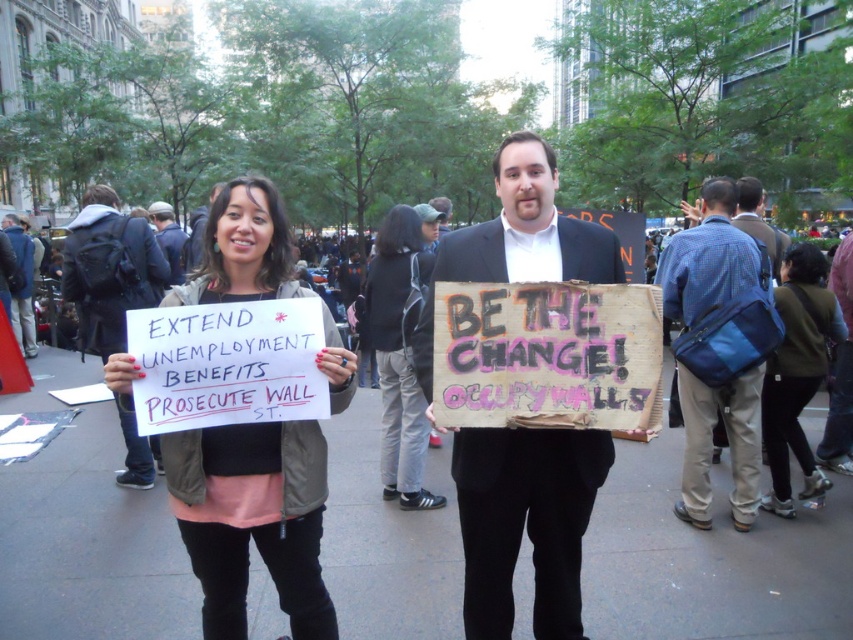
You are a protest organizer trying to arrange two signs for maximum visibility. The wooden sign at center and the matte black sign at center are both in the center. How far apart are they?

The wooden sign at center is 7.90 feet from matte black sign at center.

Looking at this image, you are a photographer trying to capture both the blue fabric bag at right and the blue denim jacket at upper left in the same frame. Given their sizes, which object should you focus on to ensure both fit in the shot?

The blue fabric bag at right is larger than the blue denim jacket at upper left, so you should focus on the larger object first to ensure both fit in the frame.